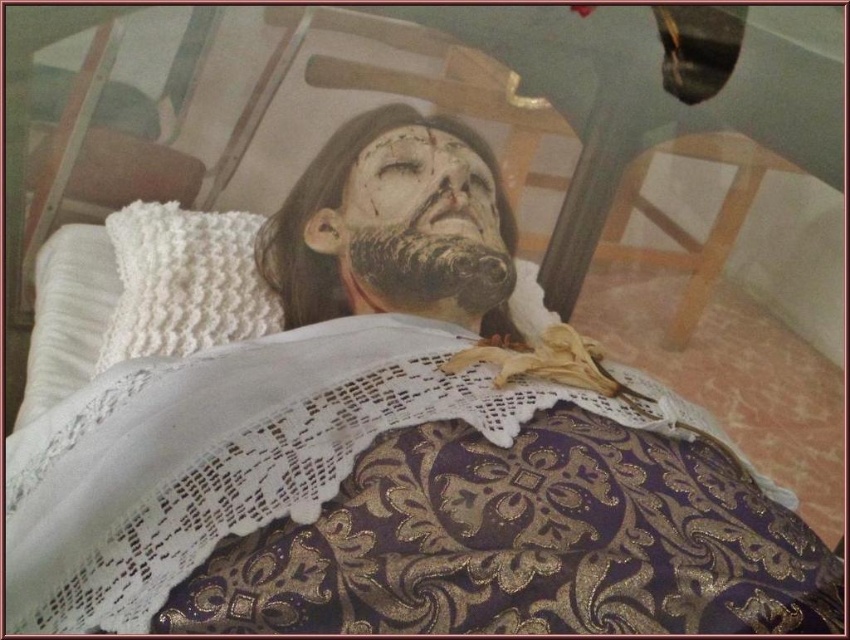
Is lace fabric at center smaller than white knitted pillow at upper left?

Incorrect, lace fabric at center is not smaller in size than white knitted pillow at upper left.

Is point (638, 420) farther from viewer compared to point (188, 291)?

No.

Does point (197, 406) come closer to viewer compared to point (259, 316)?

Yes, it is.

The width and height of the screenshot is (850, 640). Identify the location of lace fabric at center. (375, 499).

Is point (400, 160) farther from camera compared to point (435, 115)?

No, it is in front of (435, 115).

Locate an element on the screen. The width and height of the screenshot is (850, 640). matte black face at center is located at coordinates (425, 188).

Describe the element at coordinates (425, 188) in the screenshot. I see `matte black face at center` at that location.

At what (x,y) coordinates should I click in order to perform the action: click on matte black face at center. Please return your answer as a coordinate pair (x, y). This screenshot has height=640, width=850. Looking at the image, I should click on (425, 188).

Can you confirm if white knitted pillow at upper left is wider than matte black face at center?

Correct, the width of white knitted pillow at upper left exceeds that of matte black face at center.

How much distance is there between white knitted pillow at upper left and matte black face at center?

white knitted pillow at upper left and matte black face at center are 9.53 inches apart from each other.

Does point (227, 275) come behind point (389, 230)?

Yes, it is behind point (389, 230).

Locate an element on the screen. white knitted pillow at upper left is located at coordinates (184, 282).